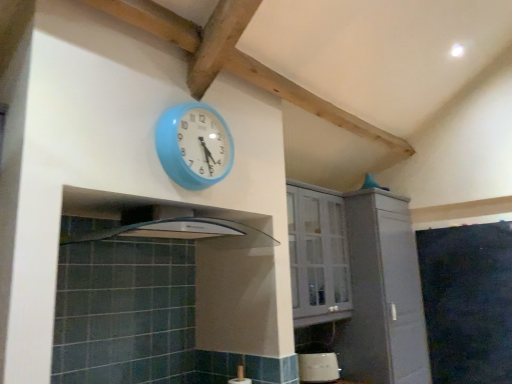
The image size is (512, 384). What do you see at coordinates (383, 293) in the screenshot?
I see `white matte cabinet at center, which is counted as the 2th cabinetry, starting from the left` at bounding box center [383, 293].

What do you see at coordinates (318, 367) in the screenshot? I see `white glossy toaster at lower center` at bounding box center [318, 367].

Image resolution: width=512 pixels, height=384 pixels. I want to click on blue plastic wall clock at upper center, so click(x=194, y=145).

Does white matte cabinet at center, which is counted as the 2th cabinetry, starting from the left, have a lesser height compared to black matte chalkboard at right?

No, white matte cabinet at center, which is counted as the 2th cabinetry, starting from the left, is not shorter than black matte chalkboard at right.

From the image's perspective, is white matte cabinet at center, which is counted as the 2th cabinetry, starting from the left, located beneath black matte chalkboard at right?

No, from the image's perspective, white matte cabinet at center, which is counted as the 2th cabinetry, starting from the left, is not beneath black matte chalkboard at right.

Is white matte cabinet at center, which is counted as the 2th cabinetry, starting from the left, facing away from black matte chalkboard at right?

No, black matte chalkboard at right is not at the back of white matte cabinet at center, which is counted as the 2th cabinetry, starting from the left.

Considering the relative positions of white matte cabinet at center, which is the first cabinetry in right-to-left order, and black matte chalkboard at right in the image provided, is white matte cabinet at center, which is the first cabinetry in right-to-left order, to the left of black matte chalkboard at right from the viewer's perspective?

Yes, white matte cabinet at center, which is the first cabinetry in right-to-left order, is to the left of black matte chalkboard at right.

Is white glossy cabinet at upper center, positioned as the 1th cabinetry in left-to-right order, positioned far away from blue plastic wall clock at upper center?

Yes.

From a real-world perspective, is white glossy cabinet at upper center, positioned as the 1th cabinetry in left-to-right order, positioned above or below blue plastic wall clock at upper center?

In terms of real-world spatial position, white glossy cabinet at upper center, positioned as the 1th cabinetry in left-to-right order, is below blue plastic wall clock at upper center.

Does white glossy cabinet at upper center, positioned as the 1th cabinetry in left-to-right order, turn towards blue plastic wall clock at upper center?

No, white glossy cabinet at upper center, positioned as the 1th cabinetry in left-to-right order, is not oriented towards blue plastic wall clock at upper center.

Considering the sizes of objects white glossy toaster at lower center and black matte chalkboard at right in the image provided, who is wider, white glossy toaster at lower center or black matte chalkboard at right?

white glossy toaster at lower center.

Is white glossy toaster at lower center oriented towards black matte chalkboard at right?

No, white glossy toaster at lower center is not turned towards black matte chalkboard at right.

Does white glossy toaster at lower center contain black matte chalkboard at right?

No, black matte chalkboard at right is not a part of white glossy toaster at lower center.

From a real-world perspective, is white glossy toaster at lower center physically located above or below black matte chalkboard at right?

Clearly, from a real-world perspective, white glossy toaster at lower center is below black matte chalkboard at right.

Who is more distant, black matte chalkboard at right or white matte cabinet at center, which is counted as the 2th cabinetry, starting from the left?

black matte chalkboard at right.

Is black matte chalkboard at right located outside white matte cabinet at center, which is counted as the 2th cabinetry, starting from the left?

black matte chalkboard at right lies outside white matte cabinet at center, which is counted as the 2th cabinetry, starting from the left,'s area.

Is black matte chalkboard at right oriented away from white glossy cabinet at upper center, which is counted as the 2th cabinetry, starting from the right?

No.

Considering the relative positions of black matte chalkboard at right and white glossy cabinet at upper center, positioned as the 1th cabinetry in left-to-right order, in the image provided, is black matte chalkboard at right to the right of white glossy cabinet at upper center, positioned as the 1th cabinetry in left-to-right order, from the viewer's perspective?

Indeed, black matte chalkboard at right is positioned on the right side of white glossy cabinet at upper center, positioned as the 1th cabinetry in left-to-right order.

Does point (487, 257) appear closer or farther from the camera than point (302, 286)?

Point (487, 257) is positioned farther from the camera compared to point (302, 286).

Where is `the 2nd cabinetry directly above the black matte chalkboard at right (from a real-world perspective)`? The height and width of the screenshot is (384, 512). the 2nd cabinetry directly above the black matte chalkboard at right (from a real-world perspective) is located at coordinates (318, 255).

Is white glossy cabinet at upper center, positioned as the 1th cabinetry in left-to-right order, aimed at white glossy toaster at lower center?

No, white glossy cabinet at upper center, positioned as the 1th cabinetry in left-to-right order, is not aimed at white glossy toaster at lower center.

You are a GUI agent. You are given a task and a screenshot of the screen. Output one action in this format:
    pyautogui.click(x=<x>, y=<y>)
    Task: Click on the 2nd cabinetry in front of the white glossy toaster at lower center
    Image resolution: width=512 pixels, height=384 pixels.
    Given the screenshot: What is the action you would take?
    pyautogui.click(x=318, y=255)

Is white glossy cabinet at upper center, which is counted as the 2th cabinetry, starting from the right, surrounding white glossy toaster at lower center?

That's incorrect, white glossy toaster at lower center is not inside white glossy cabinet at upper center, which is counted as the 2th cabinetry, starting from the right.

Which is behind, point (298, 294) or point (326, 361)?

The point (326, 361) is farther from the camera.

From a real-world perspective, between white matte cabinet at center, which is counted as the 2th cabinetry, starting from the left, and blue plastic wall clock at upper center, who is vertically lower?

white matte cabinet at center, which is counted as the 2th cabinetry, starting from the left, from a real-world perspective.

Is white matte cabinet at center, which is the first cabinetry in right-to-left order, looking in the opposite direction of blue plastic wall clock at upper center?

No.

Does white matte cabinet at center, which is counted as the 2th cabinetry, starting from the left, have a smaller size compared to blue plastic wall clock at upper center?

No.

Can you tell me how much white matte cabinet at center, which is counted as the 2th cabinetry, starting from the left, and blue plastic wall clock at upper center differ in facing direction?

white matte cabinet at center, which is counted as the 2th cabinetry, starting from the left, and blue plastic wall clock at upper center are facing 0.755 degrees away from each other.

Identify the location of the 1st cabinetry in front of the black matte chalkboard at right. (383, 293).

You are a GUI agent. You are given a task and a screenshot of the screen. Output one action in this format:
    pyautogui.click(x=<x>, y=<y>)
    Task: Click on the wall clock above the white glossy cabinet at upper center, which is counted as the 2th cabinetry, starting from the right (from the image's perspective)
    Image resolution: width=512 pixels, height=384 pixels.
    Given the screenshot: What is the action you would take?
    pyautogui.click(x=194, y=145)

Considering their positions, is white matte cabinet at center, which is the first cabinetry in right-to-left order, positioned closer to black matte chalkboard at right than white glossy toaster at lower center?

Among the two, white matte cabinet at center, which is the first cabinetry in right-to-left order, is located nearer to black matte chalkboard at right.

When comparing their distances from white glossy cabinet at upper center, which is counted as the 2th cabinetry, starting from the right, does white glossy toaster at lower center or white matte cabinet at center, which is counted as the 2th cabinetry, starting from the left, seem closer?

white matte cabinet at center, which is counted as the 2th cabinetry, starting from the left, is positioned closer to the anchor white glossy cabinet at upper center, which is counted as the 2th cabinetry, starting from the right.

Estimate the real-world distances between objects in this image. Which object is closer to blue plastic wall clock at upper center, white matte cabinet at center, which is the first cabinetry in right-to-left order, or black matte chalkboard at right?

white matte cabinet at center, which is the first cabinetry in right-to-left order.

Considering their positions, is black matte chalkboard at right positioned further to white matte cabinet at center, which is counted as the 2th cabinetry, starting from the left, than white glossy cabinet at upper center, positioned as the 1th cabinetry in left-to-right order?

black matte chalkboard at right is further to white matte cabinet at center, which is counted as the 2th cabinetry, starting from the left.

From the image, which object appears to be nearer to blue plastic wall clock at upper center, white glossy toaster at lower center or black matte chalkboard at right?

white glossy toaster at lower center is closer to blue plastic wall clock at upper center.

Considering their positions, is white matte cabinet at center, which is the first cabinetry in right-to-left order, positioned closer to blue plastic wall clock at upper center than white glossy cabinet at upper center, positioned as the 1th cabinetry in left-to-right order?

white glossy cabinet at upper center, positioned as the 1th cabinetry in left-to-right order.

Which object lies nearer to the anchor point white glossy toaster at lower center, white matte cabinet at center, which is counted as the 2th cabinetry, starting from the left, or white glossy cabinet at upper center, which is counted as the 2th cabinetry, starting from the right?

white matte cabinet at center, which is counted as the 2th cabinetry, starting from the left.

When comparing their distances from blue plastic wall clock at upper center, does white glossy cabinet at upper center, which is counted as the 2th cabinetry, starting from the right, or white matte cabinet at center, which is the first cabinetry in right-to-left order, seem further?

white matte cabinet at center, which is the first cabinetry in right-to-left order.

Identify the location of cabinetry between blue plastic wall clock at upper center and white matte cabinet at center, which is the first cabinetry in right-to-left order, from front to back. Image resolution: width=512 pixels, height=384 pixels. (318, 255).

Where is `appliance between blue plastic wall clock at upper center and black matte chalkboard at right in the horizontal direction`? appliance between blue plastic wall clock at upper center and black matte chalkboard at right in the horizontal direction is located at coordinates (318, 367).

Where is `appliance located between white glossy cabinet at upper center, positioned as the 1th cabinetry in left-to-right order, and black matte chalkboard at right in the left-right direction`? This screenshot has height=384, width=512. appliance located between white glossy cabinet at upper center, positioned as the 1th cabinetry in left-to-right order, and black matte chalkboard at right in the left-right direction is located at coordinates point(318,367).

At what (x,y) coordinates should I click in order to perform the action: click on cabinetry between white glossy cabinet at upper center, positioned as the 1th cabinetry in left-to-right order, and black matte chalkboard at right, in the horizontal direction. Please return your answer as a coordinate pair (x, y). Looking at the image, I should click on tap(383, 293).